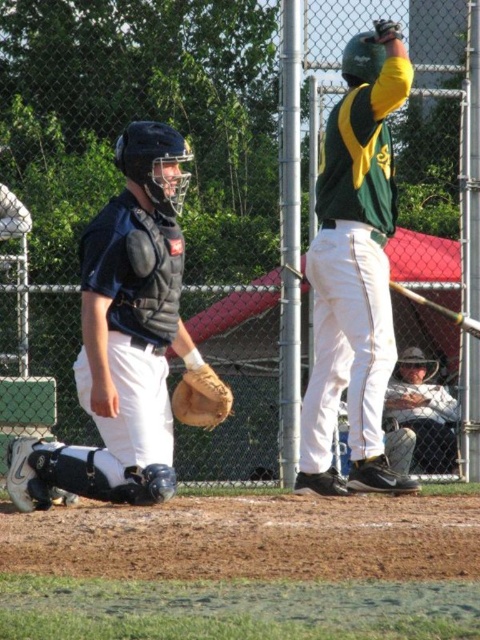
Can you confirm if matte black catcher's gear at left is positioned to the right of white cotton shirt at lower right?

In fact, matte black catcher's gear at left is to the left of white cotton shirt at lower right.

Consider the image. Is matte black catcher's gear at left below white cotton shirt at lower right?

Incorrect, matte black catcher's gear at left is not positioned below white cotton shirt at lower right.

Identify the location of matte black catcher's gear at left. (129, 340).

Where is `matte black catcher's gear at left`? This screenshot has width=480, height=640. matte black catcher's gear at left is located at coordinates (129, 340).

Who is shorter, green matte jersey at center or white cotton shirt at lower right?

white cotton shirt at lower right is shorter.

Which of these two, green matte jersey at center or white cotton shirt at lower right, stands taller?

Standing taller between the two is green matte jersey at center.

Does point (340, 164) come behind point (436, 417)?

No, it is not.

Find the location of a particular element. The height and width of the screenshot is (640, 480). green matte jersey at center is located at coordinates (355, 269).

Does matte black catcher's gear at left have a greater height compared to brown leather glove at lower left?

Correct, matte black catcher's gear at left is much taller as brown leather glove at lower left.

From the picture: Does matte black catcher's gear at left have a larger size compared to brown leather glove at lower left?

Correct, matte black catcher's gear at left is larger in size than brown leather glove at lower left.

Describe the element at coordinates (129, 340) in the screenshot. The width and height of the screenshot is (480, 640). I see `matte black catcher's gear at left` at that location.

The image size is (480, 640). Identify the location of matte black catcher's gear at left. (129, 340).